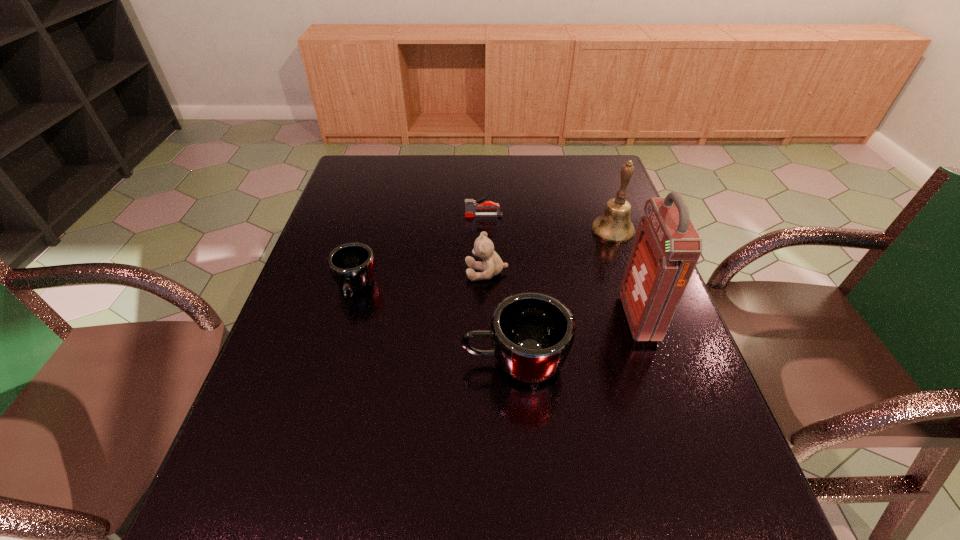
You are a GUI agent. You are given a task and a screenshot of the screen. Output one action in this format:
    pyautogui.click(x=<x>, y=<y>)
    Task: Click on the vacant region at the far right corner of the desktop
    This screenshot has height=540, width=960.
    Given the screenshot: What is the action you would take?
    pyautogui.click(x=584, y=170)

Find the location of a particular element. The width and height of the screenshot is (960, 540). free space between the fourth tallest object and the bell is located at coordinates (550, 251).

Locate an element on the screen. The height and width of the screenshot is (540, 960). free space between the first-aid kit and the stapler is located at coordinates (561, 267).

Identify the location of vacant space that is in between the third shortest object and the bell. The width and height of the screenshot is (960, 540). (550, 251).

Where is `vacant space that is in between the bell and the teddy bear`? This screenshot has width=960, height=540. vacant space that is in between the bell and the teddy bear is located at coordinates (550, 251).

This screenshot has width=960, height=540. What are the coordinates of `free space between the first-aid kit and the stapler` in the screenshot? It's located at (561, 267).

I want to click on free space between the farther mug and the third shortest object, so click(x=420, y=280).

Image resolution: width=960 pixels, height=540 pixels. In order to click on free space between the first-aid kit and the stapler in this screenshot , I will do `click(561, 267)`.

Where is `the fifth closest object to the tallest object`? The width and height of the screenshot is (960, 540). the fifth closest object to the tallest object is located at coordinates (352, 265).

Locate which object ranks second in proximity to the first-aid kit. Please provide its 2D coordinates. Your answer should be formatted as a tuple, i.e. [(x, y)], where the tuple contains the x and y coordinates of a point satisfying the conditions above.

[(614, 225)]